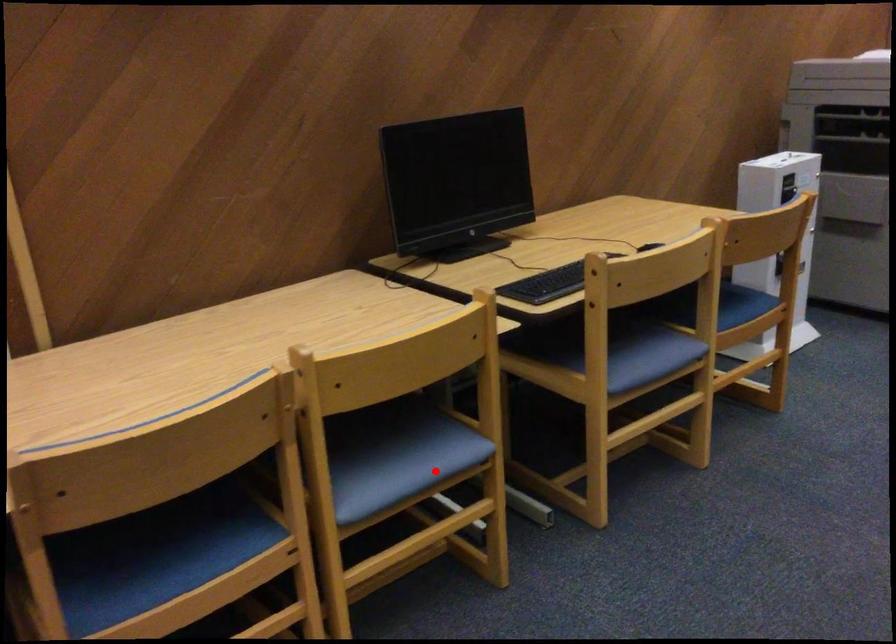
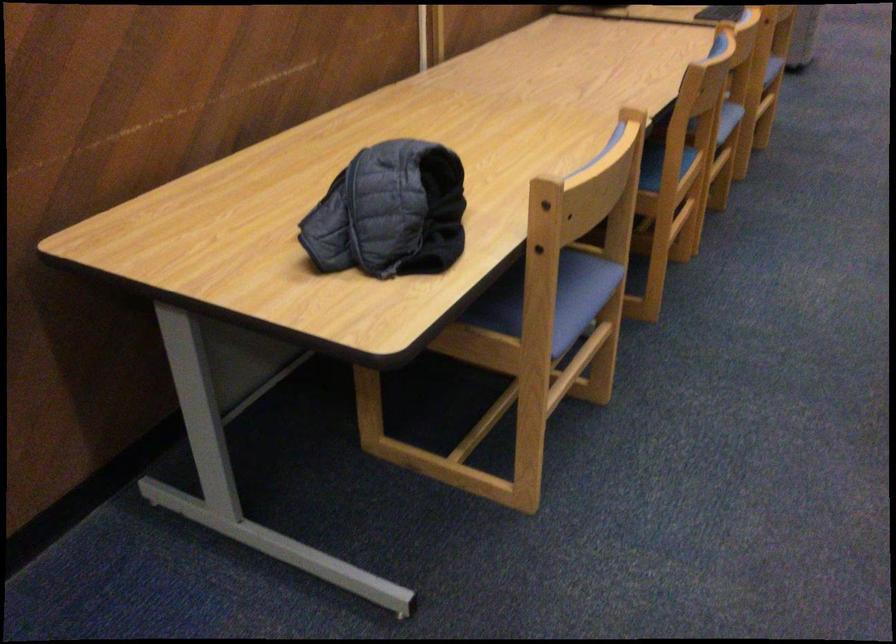
Locate, in the second image, the point that corresponds to the highlighted location in the first image.

(728, 118)